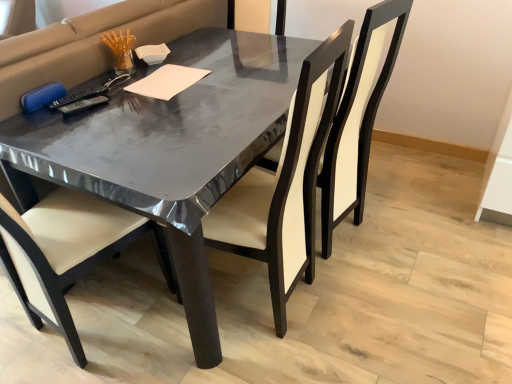
This screenshot has width=512, height=384. I want to click on free space in front of matte black chair at center, the first chair positioned from the right, so [x=372, y=304].